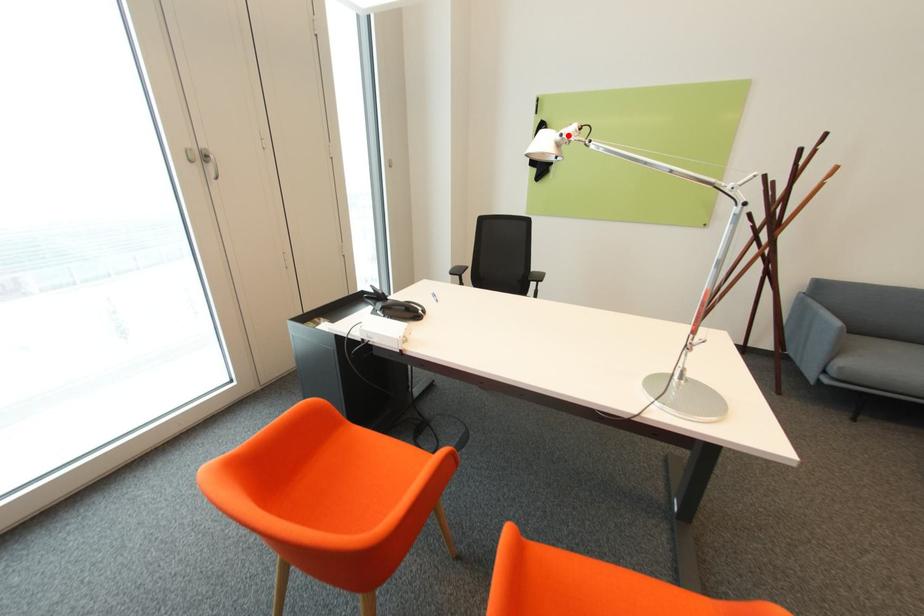
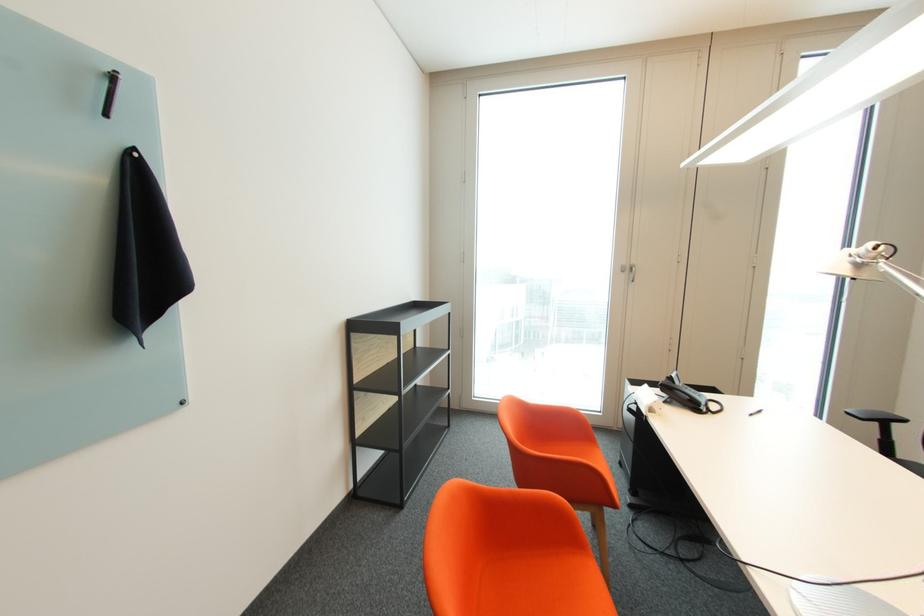
Locate, in the second image, the point that corresponds to the highlighted location in the first image.

(860, 256)